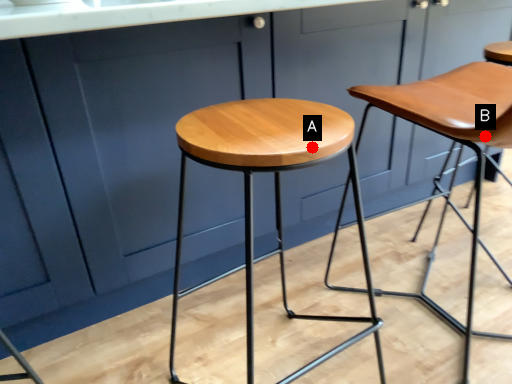
Question: Two points are circled on the image, labeled by A and B beside each circle. Which point is further to the camera?

Choices:
 (A) A is further
 (B) B is further

Answer: (B)